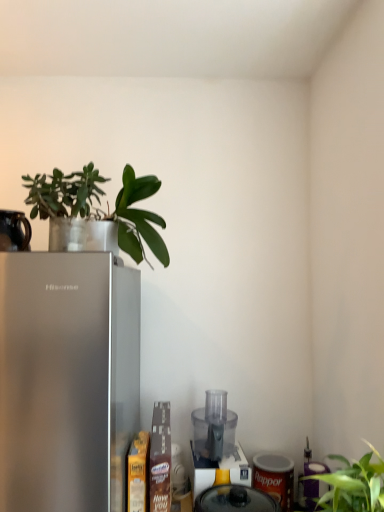
Question: Does translucent plastic food processor at center, the 3th appliance when ordered from left to right, appear on the left side of transparent plastic blender at center?

Choices:
 (A) no
 (B) yes

Answer: (A)

Question: Are translucent plastic food processor at center, the 3th appliance when ordered from left to right, and transparent plastic blender at center located far from each other?

Choices:
 (A) no
 (B) yes

Answer: (A)

Question: From a real-world perspective, is translucent plastic food processor at center, positioned as the 3th appliance in top-to-bottom order, physically below transparent plastic blender at center?

Choices:
 (A) yes
 (B) no

Answer: (B)

Question: Does translucent plastic food processor at center, positioned as the 3th appliance in top-to-bottom order, have a larger size compared to transparent plastic blender at center?

Choices:
 (A) no
 (B) yes

Answer: (A)

Question: Is translucent plastic food processor at center, positioned as the second appliance in front-to-back order, aimed at transparent plastic blender at center?

Choices:
 (A) yes
 (B) no

Answer: (B)

Question: In terms of size, does black ceramic mug at upper left, positioned as the third appliance in right-to-left order, appear bigger or smaller than satin silver refrigerator at left?

Choices:
 (A) small
 (B) big

Answer: (A)

Question: Would you say black ceramic mug at upper left, which ranks as the first appliance in left-to-right order, is inside or outside satin silver refrigerator at left?

Choices:
 (A) inside
 (B) outside

Answer: (B)

Question: Considering the positions of black ceramic mug at upper left, arranged as the third appliance when viewed from the back, and satin silver refrigerator at left in the image, is black ceramic mug at upper left, arranged as the third appliance when viewed from the back, taller or shorter than satin silver refrigerator at left?

Choices:
 (A) short
 (B) tall

Answer: (A)

Question: Considering their positions, is black ceramic mug at upper left, positioned as the third appliance in right-to-left order, located in front of or behind satin silver refrigerator at left?

Choices:
 (A) front
 (B) behind

Answer: (B)

Question: Is point 201,446 closer or farther from the camera than point 271,505?

Choices:
 (A) closer
 (B) farther

Answer: (B)

Question: From a real-world perspective, is transparent plastic food processor at lower center, positioned as the second appliance in top-to-bottom order, physically located above or below translucent plastic food processor at center, positioned as the 3th appliance in top-to-bottom order?

Choices:
 (A) below
 (B) above

Answer: (B)

Question: In terms of height, does transparent plastic food processor at lower center, arranged as the second appliance when viewed from the left, look taller or shorter compared to translucent plastic food processor at center, positioned as the 3th appliance in top-to-bottom order?

Choices:
 (A) tall
 (B) short

Answer: (A)

Question: From the image's perspective, is transparent plastic food processor at lower center, positioned as the second appliance in top-to-bottom order, located above or below translucent plastic food processor at center, the 3th appliance when ordered from left to right?

Choices:
 (A) below
 (B) above

Answer: (B)

Question: Considering the positions of black ceramic mug at upper left, which ranks as the first appliance in left-to-right order, and transparent plastic food processor at lower center, placed as the second appliance when sorted from right to left, in the image, is black ceramic mug at upper left, which ranks as the first appliance in left-to-right order, wider or thinner than transparent plastic food processor at lower center, placed as the second appliance when sorted from right to left,?

Choices:
 (A) thin
 (B) wide

Answer: (A)

Question: Relative to transparent plastic food processor at lower center, the 1th appliance viewed from the back, is black ceramic mug at upper left, which ranks as the first appliance in left-to-right order, in front or behind?

Choices:
 (A) behind
 (B) front

Answer: (B)